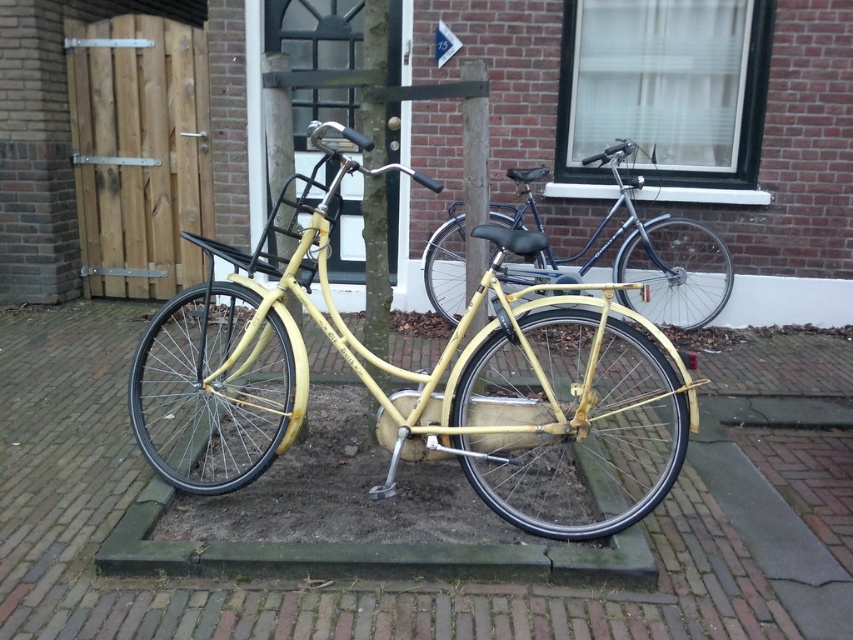
Question: Which object is closer to the camera taking this photo?

Choices:
 (A) yellow matte bicycle at center
 (B) matte blue bicycle at center
 (C) wooden gate at left

Answer: (A)

Question: Is wooden gate at left in front of matte blue bicycle at center?

Choices:
 (A) no
 (B) yes

Answer: (A)

Question: Does wooden gate at left have a smaller size compared to matte blue bicycle at center?

Choices:
 (A) yes
 (B) no

Answer: (A)

Question: Which point is closer to the camera taking this photo?

Choices:
 (A) (155, 88)
 (B) (445, 246)

Answer: (B)

Question: Estimate the real-world distances between objects in this image. Which object is farther from the matte blue bicycle at center?

Choices:
 (A) wooden gate at left
 (B) yellow matte bicycle at center

Answer: (A)

Question: Is yellow matte bicycle at center closer to the viewer compared to matte blue bicycle at center?

Choices:
 (A) no
 (B) yes

Answer: (B)